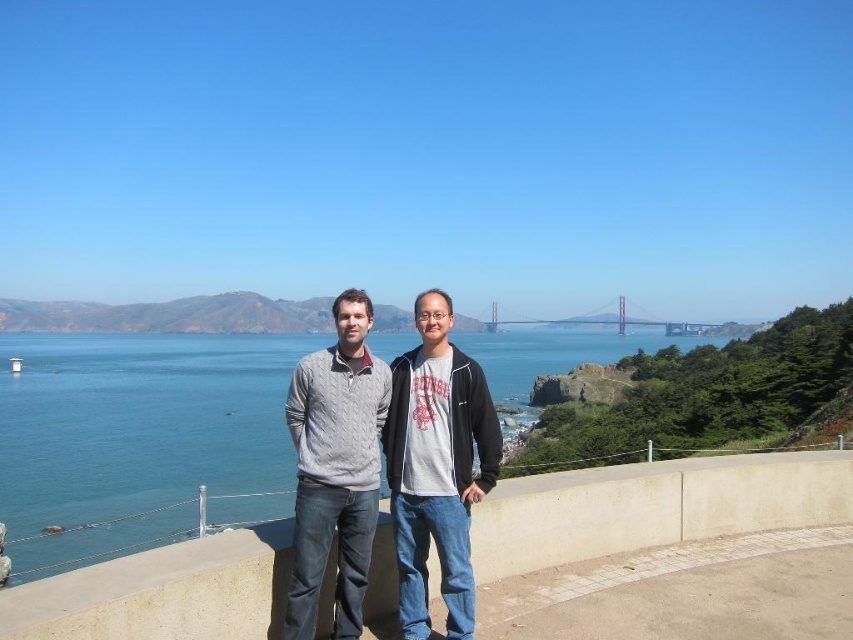
You are standing on the concrete ledge at center and want to look at the blue water at center. In which direction should you turn your head?

You should turn your head to the left to look at the blue water at center, since the blue water at center is to the left of the concrete ledge at center.